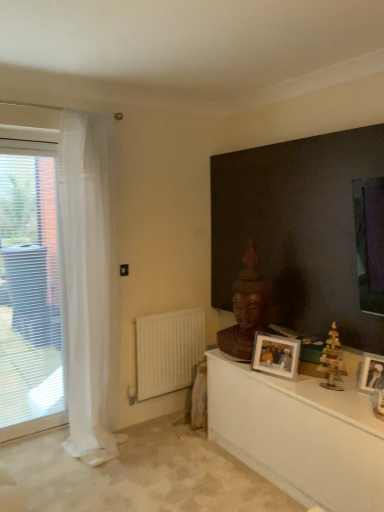
Identify the location of free space to the left of wooden toy at right. This screenshot has height=512, width=384. (301, 388).